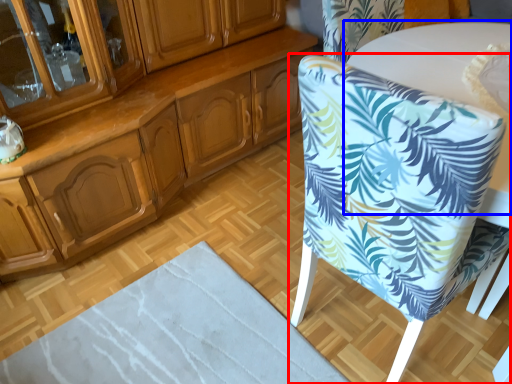
Question: Among these objects, which one is nearest to the camera, chair (highlighted by a red box) or round table (highlighted by a blue box)?

Choices:
 (A) chair
 (B) round table

Answer: (A)